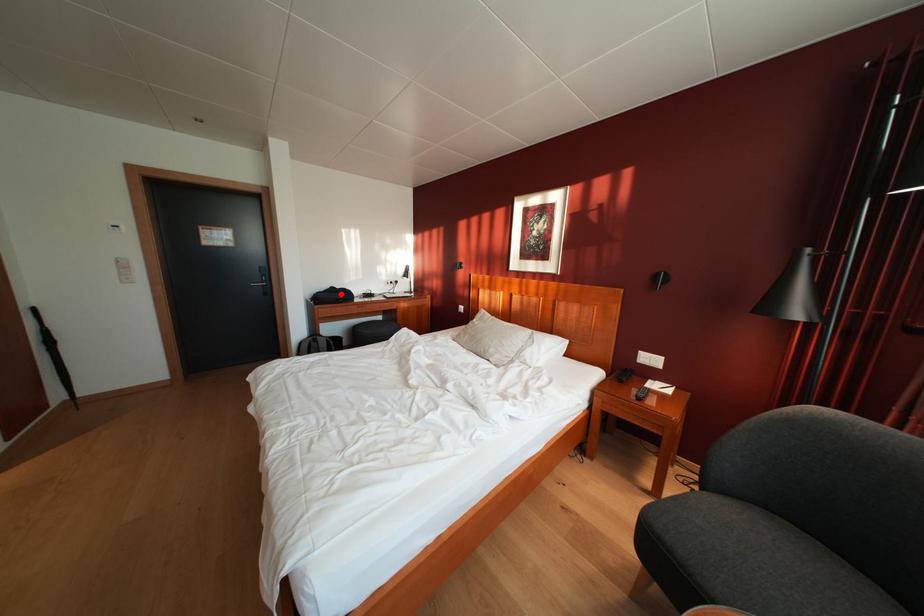
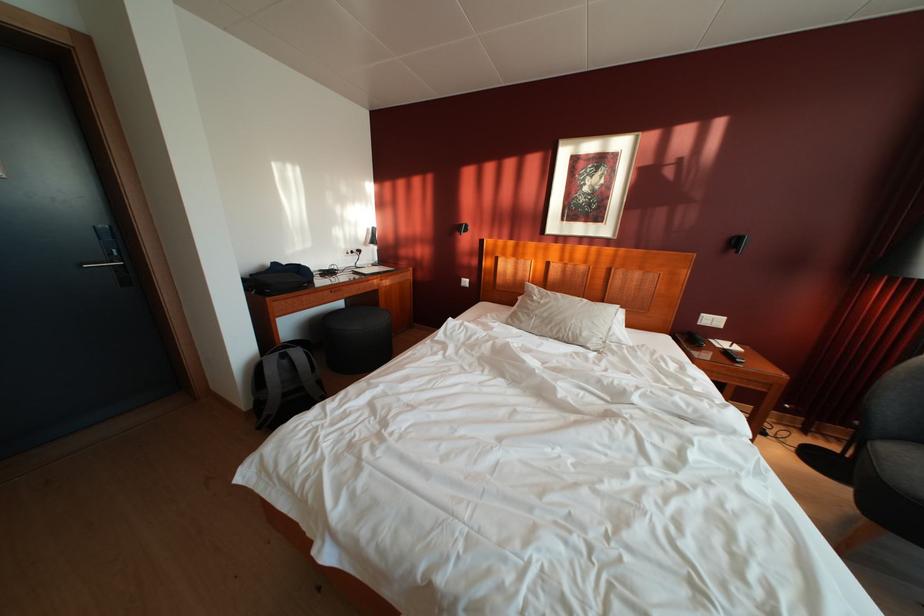
Find the pixel in the second image that matches the highlighted location in the first image.

(284, 270)